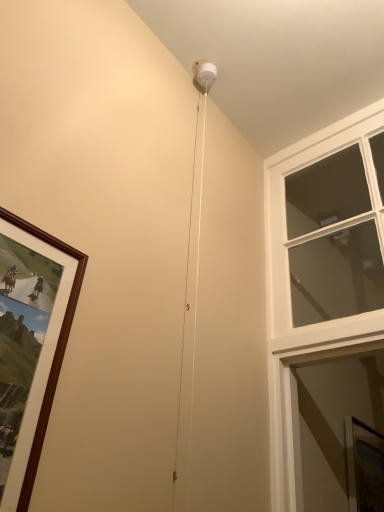
Question: Can you confirm if clear glass window at upper right is shorter than clear glass window screen at lower right?

Choices:
 (A) no
 (B) yes

Answer: (A)

Question: Does clear glass window at upper right lie in front of clear glass window screen at lower right?

Choices:
 (A) no
 (B) yes

Answer: (B)

Question: Is clear glass window at upper right facing away from clear glass window screen at lower right?

Choices:
 (A) yes
 (B) no

Answer: (A)

Question: Is clear glass window at upper right to the left of clear glass window screen at lower right from the viewer's perspective?

Choices:
 (A) yes
 (B) no

Answer: (A)

Question: From the image's perspective, is clear glass window at upper right on clear glass window screen at lower right?

Choices:
 (A) no
 (B) yes

Answer: (B)

Question: From the image's perspective, is clear glass window at upper right under clear glass window screen at lower right?

Choices:
 (A) no
 (B) yes

Answer: (A)

Question: Does clear glass window screen at lower right appear on the left side of clear glass window at upper right?

Choices:
 (A) yes
 (B) no

Answer: (B)

Question: Is clear glass window screen at lower right outside clear glass window at upper right?

Choices:
 (A) yes
 (B) no

Answer: (A)

Question: Is clear glass window screen at lower right wider than clear glass window at upper right?

Choices:
 (A) no
 (B) yes

Answer: (A)

Question: Could you tell me if clear glass window screen at lower right is facing clear glass window at upper right?

Choices:
 (A) yes
 (B) no

Answer: (B)

Question: Is the depth of clear glass window screen at lower right less than that of clear glass window at upper right?

Choices:
 (A) yes
 (B) no

Answer: (B)

Question: Does clear glass window screen at lower right contain clear glass window at upper right?

Choices:
 (A) yes
 (B) no

Answer: (B)

Question: From a real-world perspective, relative to clear glass window screen at lower right, is clear glass window at upper right vertically above or below?

Choices:
 (A) below
 (B) above

Answer: (B)